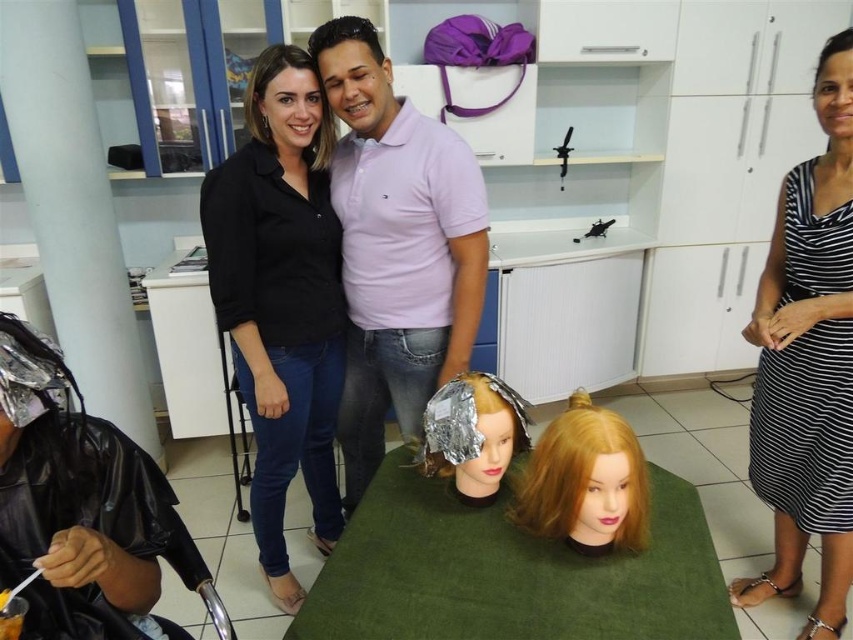
Describe the element at coordinates (281, 298) in the screenshot. The image size is (853, 640). I see `black matte shirt at center` at that location.

Does black matte shirt at center appear on the right side of shiny gold foil at center?

Incorrect, black matte shirt at center is not on the right side of shiny gold foil at center.

Does point (264, 236) come in front of point (440, 444)?

No, it is not.

Find the location of a particular element. This screenshot has height=640, width=853. black matte shirt at center is located at coordinates (281, 298).

Between striped fabric dress at lower right and dark brown hair at center, which one appears on the left side from the viewer's perspective?

dark brown hair at center

Is point (851, 285) less distant than point (306, 38)?

Yes, it is.

Locate an element on the screen. The width and height of the screenshot is (853, 640). striped fabric dress at lower right is located at coordinates pyautogui.click(x=807, y=369).

Consider the image. Who is lower down, blonde synthetic hair at center or dark brown shiny hair at upper right?

Positioned lower is blonde synthetic hair at center.

Between blonde synthetic hair at center and dark brown shiny hair at upper right, which one has more height?

Standing taller between the two is blonde synthetic hair at center.

Is point (643, 544) closer to camera compared to point (816, 72)?

Yes, point (643, 544) is in front of point (816, 72).

Find the location of a particular element. The width and height of the screenshot is (853, 640). blonde synthetic hair at center is located at coordinates (585, 481).